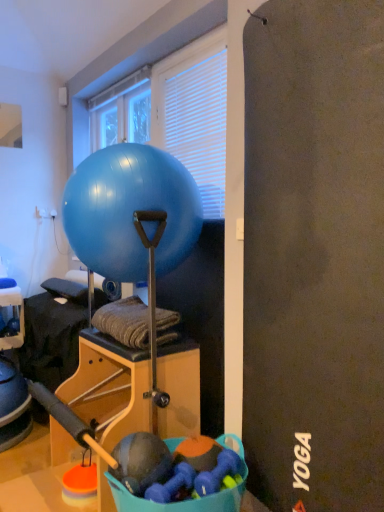
What do you see at coordinates (131, 211) in the screenshot?
I see `blue glossy exercise ball at center` at bounding box center [131, 211].

What do you see at coordinates (200, 127) in the screenshot?
I see `white blinds at upper center` at bounding box center [200, 127].

Locate an element on the screen. Image resolution: width=384 pixels, height=512 pixels. blue glossy exercise ball at center is located at coordinates (131, 211).

From the picture: Can you see transparent glass window at upper center touching blue glossy exercise ball at center?

transparent glass window at upper center is not next to blue glossy exercise ball at center, and they're not touching.

How many degrees apart are the facing directions of transparent glass window at upper center and blue glossy exercise ball at center?

The facing directions of transparent glass window at upper center and blue glossy exercise ball at center are 0.526 degrees apart.

Is transparent glass window at upper center behind blue glossy exercise ball at center?

Yes, transparent glass window at upper center is further from the viewer.

Between transparent glass window at upper center and blue glossy exercise ball at center, which one has more height?

Standing taller between the two is blue glossy exercise ball at center.

How distant is transparent glass window at upper center from white blinds at upper center?

transparent glass window at upper center is 21.05 inches from white blinds at upper center.

Does transparent glass window at upper center turn towards white blinds at upper center?

No, transparent glass window at upper center is not turned towards white blinds at upper center.

Image resolution: width=384 pixels, height=512 pixels. Identify the location of window on the left of white blinds at upper center. (122, 111).

From a real-world perspective, does transparent glass window at upper center stand above white blinds at upper center?

Yes, from a real-world perspective, transparent glass window at upper center is over white blinds at upper center

From a real-world perspective, which object stands above the other?

transparent glass window at upper center.

Who is shorter, blue glossy exercise ball at center or transparent glass window at upper center?

transparent glass window at upper center.

Is blue glossy exercise ball at center in front of or behind transparent glass window at upper center in the image?

blue glossy exercise ball at center is in front of transparent glass window at upper center.

In the scene shown: From the image's perspective, is blue glossy exercise ball at center located above or below white blinds at upper center?

From the image's perspective, blue glossy exercise ball at center appears below white blinds at upper center.

Is blue glossy exercise ball at center further to the viewer compared to white blinds at upper center?

No.

Is blue glossy exercise ball at center positioned far away from white blinds at upper center?

They are positioned close to each other.

Does blue glossy exercise ball at center have a smaller size compared to white blinds at upper center?

No, blue glossy exercise ball at center is not smaller than white blinds at upper center.

Is white blinds at upper center not inside transparent glass window at upper center?

white blinds at upper center is positioned outside transparent glass window at upper center.

From a real-world perspective, is white blinds at upper center located beneath transparent glass window at upper center?

Yes, from a real-world perspective, white blinds at upper center is beneath transparent glass window at upper center.

What's the angular difference between white blinds at upper center and transparent glass window at upper center's facing directions?

There is a 0.00154-degree angle between the facing directions of white blinds at upper center and transparent glass window at upper center.

Who is bigger, white blinds at upper center or transparent glass window at upper center?

white blinds at upper center.

From the image's perspective, is white blinds at upper center above or below blue glossy exercise ball at center?

From the image's perspective, white blinds at upper center appears above blue glossy exercise ball at center.

Between white blinds at upper center and blue glossy exercise ball at center, which one has larger width?

Wider between the two is blue glossy exercise ball at center.

Between white blinds at upper center and blue glossy exercise ball at center, which one has smaller size?

white blinds at upper center.

Can you confirm if white blinds at upper center is positioned to the left of blue glossy exercise ball at center?

No.

Locate an element on the screen. This screenshot has width=384, height=512. ball in front of the transparent glass window at upper center is located at coordinates (131, 211).

At what (x,y) coordinates should I click in order to perform the action: click on blind on the right of transparent glass window at upper center. Please return your answer as a coordinate pair (x, y). The width and height of the screenshot is (384, 512). Looking at the image, I should click on (200, 127).

Estimate the real-world distances between objects in this image. Which object is closer to white blinds at upper center, transparent glass window at upper center or blue glossy exercise ball at center?

Among the two, blue glossy exercise ball at center is located nearer to white blinds at upper center.

In the scene shown: Estimate the real-world distances between objects in this image. Which object is closer to transparent glass window at upper center, white blinds at upper center or blue glossy exercise ball at center?

white blinds at upper center is closer to transparent glass window at upper center.

From the image, which object appears to be farther from transparent glass window at upper center, blue glossy exercise ball at center or white blinds at upper center?

Among the two, blue glossy exercise ball at center is located further to transparent glass window at upper center.

Considering their positions, is transparent glass window at upper center positioned closer to blue glossy exercise ball at center than white blinds at upper center?

white blinds at upper center is positioned closer to the anchor blue glossy exercise ball at center.

Looking at this image, considering their positions, is blue glossy exercise ball at center positioned closer to white blinds at upper center than transparent glass window at upper center?

blue glossy exercise ball at center is positioned closer to the anchor white blinds at upper center.

Estimate the real-world distances between objects in this image. Which object is closer to blue glossy exercise ball at center, white blinds at upper center or transparent glass window at upper center?

The object closer to blue glossy exercise ball at center is white blinds at upper center.

I want to click on blind between blue glossy exercise ball at center and transparent glass window at upper center along the z-axis, so click(200, 127).